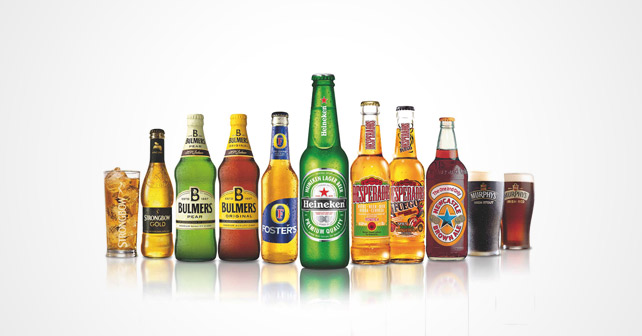
The width and height of the screenshot is (642, 336). I want to click on beer bottles, so click(x=159, y=203), click(x=200, y=204), click(x=247, y=204), click(x=270, y=208), click(x=324, y=210), click(x=369, y=211), click(x=404, y=212), click(x=451, y=214).